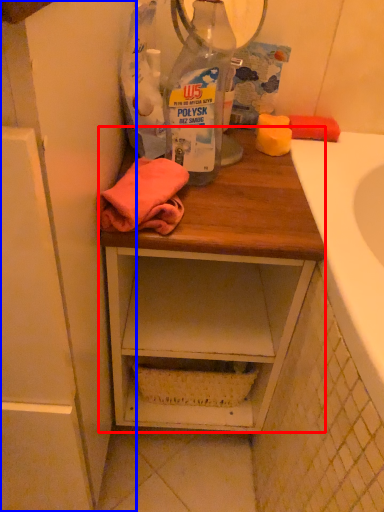
Question: Among these objects, which one is nearest to the camera, desk (highlighted by a red box) or cabinetry (highlighted by a blue box)?

Choices:
 (A) desk
 (B) cabinetry

Answer: (B)